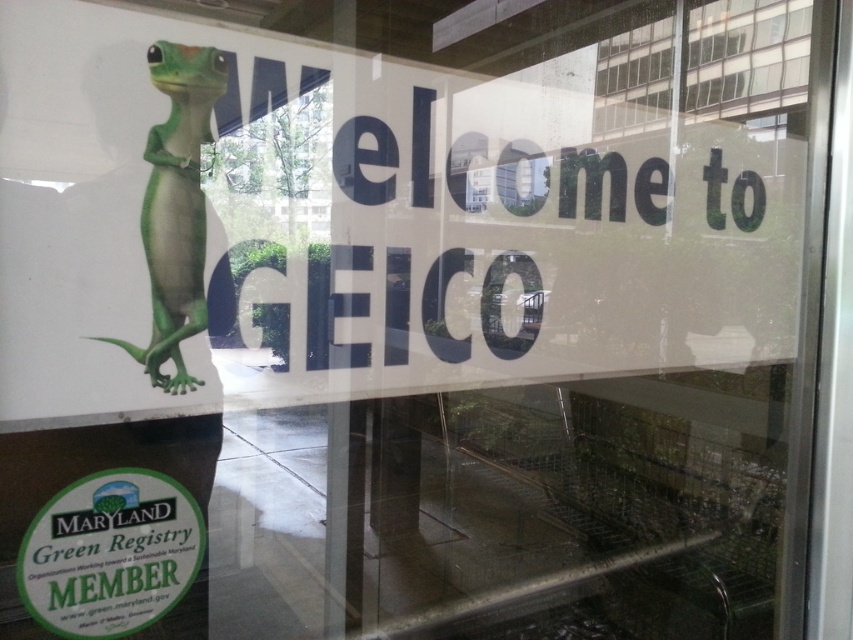
You are an interior designer planning to hang two items on a wall. You have a transparent glass window at upper center and a green matte lizard at upper left. Which object will occupy more space on the wall?

Answer: The transparent glass window at upper center is bigger than the green matte lizard at upper left, so it will occupy more space on the wall.

You are standing outside a building and see the transparent glass window at upper center and the green matte lizard at upper left. Which object is higher up on the window?

The transparent glass window at upper center is above the green matte lizard at upper left, so it is higher up on the window.

You are standing in front of the GEICO window sign and want to touch both points on the window. Which point will you reach first, point (643,81) or point (189,284)?

You will reach point (643,81) first because it is closer to you than point (189,284), which is further away.